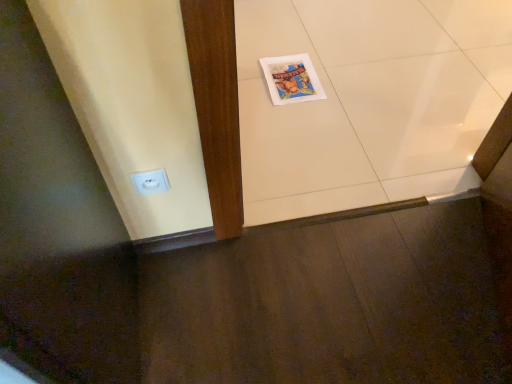
Question: Is white glossy tile at center to the right of matte paper comic book at center from the viewer's perspective?

Choices:
 (A) yes
 (B) no

Answer: (A)

Question: Can you confirm if white glossy tile at center is shorter than matte paper comic book at center?

Choices:
 (A) yes
 (B) no

Answer: (B)

Question: Would you consider white glossy tile at center to be distant from matte paper comic book at center?

Choices:
 (A) no
 (B) yes

Answer: (A)

Question: Is white glossy tile at center positioned with its back to matte paper comic book at center?

Choices:
 (A) no
 (B) yes

Answer: (B)

Question: Is the depth of white glossy tile at center less than that of matte paper comic book at center?

Choices:
 (A) no
 (B) yes

Answer: (B)

Question: Can you confirm if white glossy tile at center is wider than matte paper comic book at center?

Choices:
 (A) yes
 (B) no

Answer: (A)

Question: Are white plastic electric outlet at lower left and matte paper comic book at center beside each other?

Choices:
 (A) yes
 (B) no

Answer: (B)

Question: Is white plastic electric outlet at lower left thinner than matte paper comic book at center?

Choices:
 (A) yes
 (B) no

Answer: (A)

Question: Can you confirm if white plastic electric outlet at lower left is smaller than matte paper comic book at center?

Choices:
 (A) yes
 (B) no

Answer: (A)

Question: Is white plastic electric outlet at lower left bigger than matte paper comic book at center?

Choices:
 (A) yes
 (B) no

Answer: (B)

Question: From the image's perspective, is white plastic electric outlet at lower left beneath matte paper comic book at center?

Choices:
 (A) yes
 (B) no

Answer: (A)

Question: Considering the relative sizes of white plastic electric outlet at lower left and matte paper comic book at center in the image provided, is white plastic electric outlet at lower left taller than matte paper comic book at center?

Choices:
 (A) no
 (B) yes

Answer: (B)

Question: Is matte paper comic book at center placed right next to white glossy tile at center?

Choices:
 (A) no
 (B) yes

Answer: (A)